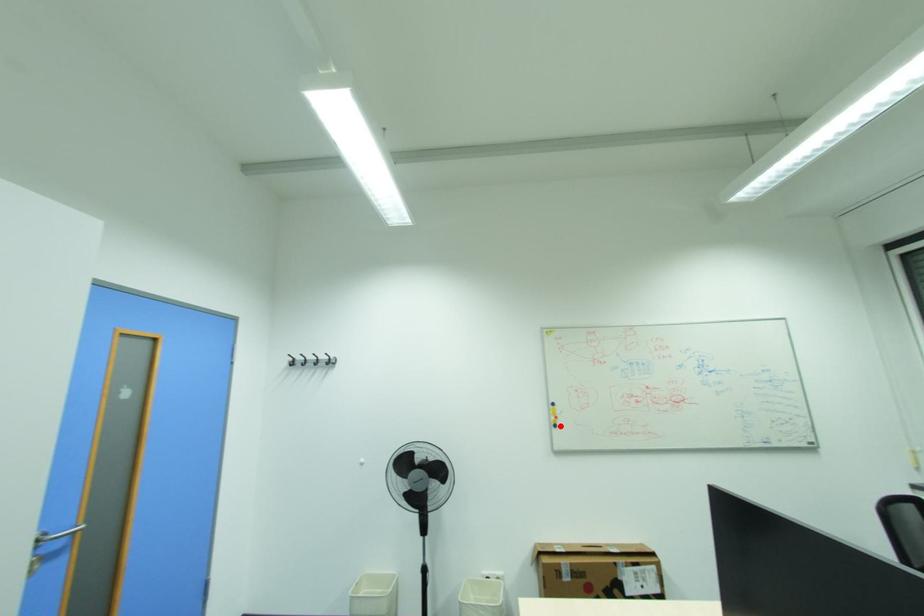
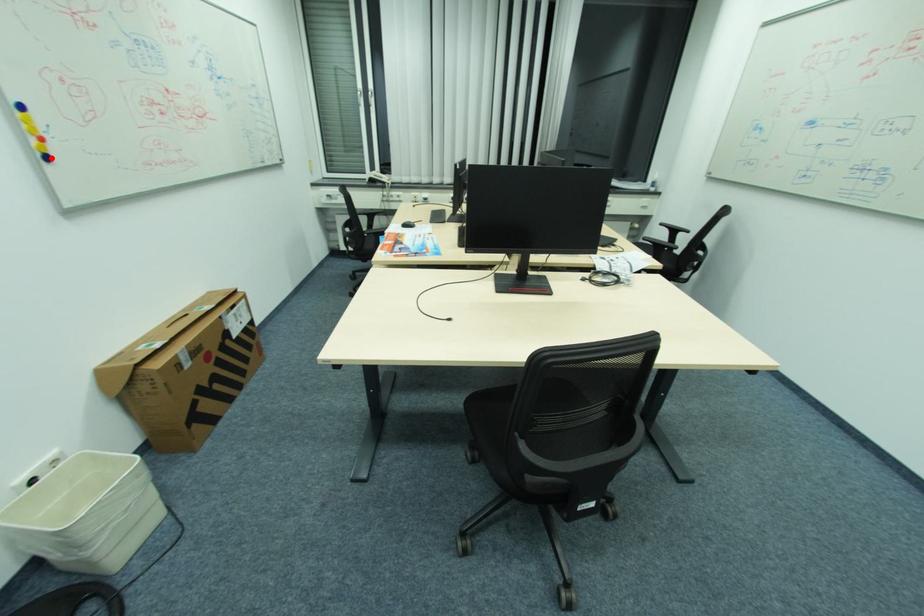
I am providing you with two images of the same scene from different viewpoints. A red point is marked on the first image and another point is marked on the second image. Are the points marked in image1 and image2 representing the same 3D position?

Answer: Yes